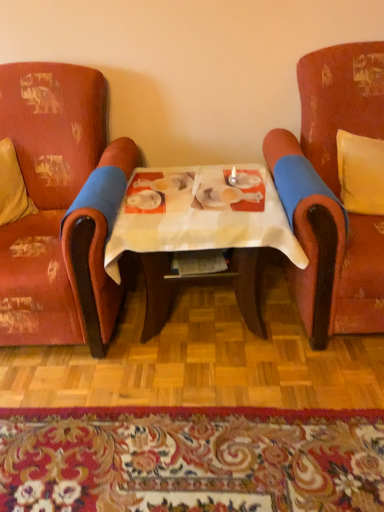
Question: Can you confirm if beige fabric pillow at left, placed as the 2th pillow when sorted from right to left, is thinner than floral carpet at lower center?

Choices:
 (A) yes
 (B) no

Answer: (A)

Question: Is beige fabric pillow at left, which appears as the 1th pillow when viewed from the left, located outside floral carpet at lower center?

Choices:
 (A) no
 (B) yes

Answer: (B)

Question: Considering the relative sizes of beige fabric pillow at left, which appears as the 1th pillow when viewed from the left, and floral carpet at lower center in the image provided, is beige fabric pillow at left, which appears as the 1th pillow when viewed from the left, wider than floral carpet at lower center?

Choices:
 (A) yes
 (B) no

Answer: (B)

Question: Would you say beige fabric pillow at left, which appears as the 1th pillow when viewed from the left, contains floral carpet at lower center?

Choices:
 (A) no
 (B) yes

Answer: (A)

Question: From a real-world perspective, is beige fabric pillow at left, placed as the 2th pillow when sorted from right to left, located beneath floral carpet at lower center?

Choices:
 (A) yes
 (B) no

Answer: (B)

Question: Visually, is floral carpet at lower center positioned to the left or to the right of beige fabric pillow at left, placed as the 2th pillow when sorted from right to left?

Choices:
 (A) right
 (B) left

Answer: (A)

Question: In terms of width, does floral carpet at lower center look wider or thinner when compared to beige fabric pillow at left, placed as the 2th pillow when sorted from right to left?

Choices:
 (A) thin
 (B) wide

Answer: (B)

Question: From a real-world perspective, is floral carpet at lower center positioned above or below beige fabric pillow at left, which appears as the 1th pillow when viewed from the left?

Choices:
 (A) below
 (B) above

Answer: (A)

Question: From the image's perspective, is floral carpet at lower center above or below beige fabric pillow at left, which appears as the 1th pillow when viewed from the left?

Choices:
 (A) above
 (B) below

Answer: (B)

Question: Is point (344, 167) positioned closer to the camera than point (23, 301)?

Choices:
 (A) closer
 (B) farther

Answer: (B)

Question: Would you say yellow fabric pillow at right, the 1th pillow in the right-to-left sequence, is inside or outside distressed red fabric armchair at left, the second chair in the right-to-left sequence?

Choices:
 (A) outside
 (B) inside

Answer: (A)

Question: Would you say yellow fabric pillow at right, which is the second pillow in left-to-right order, is to the left or to the right of distressed red fabric armchair at left, the second chair in the right-to-left sequence, in the picture?

Choices:
 (A) left
 (B) right

Answer: (B)

Question: Is yellow fabric pillow at right, the 1th pillow in the right-to-left sequence, bigger or smaller than distressed red fabric armchair at left, the second chair in the right-to-left sequence?

Choices:
 (A) big
 (B) small

Answer: (B)

Question: From the image's perspective, is distressed red fabric armchair at left, the second chair in the right-to-left sequence, located above or below beige fabric pillow at left, placed as the 2th pillow when sorted from right to left?

Choices:
 (A) below
 (B) above

Answer: (A)

Question: Is point (84, 302) closer or farther from the camera than point (23, 204)?

Choices:
 (A) farther
 (B) closer

Answer: (B)